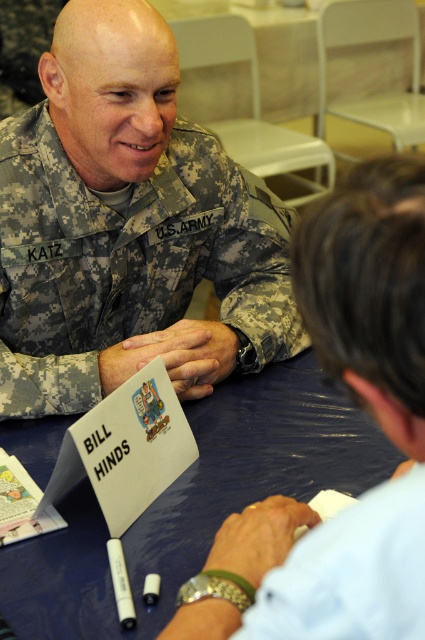
Which of these two, camouflage fabric us army uniform at center or blue fabric table at center, stands shorter?

Standing shorter between the two is blue fabric table at center.

Identify the location of camouflage fabric us army uniform at center. (130, 260).

Which is behind, point (149, 236) or point (274, 406)?

Point (149, 236)

Identify the location of camouflage fabric us army uniform at center. (130, 260).